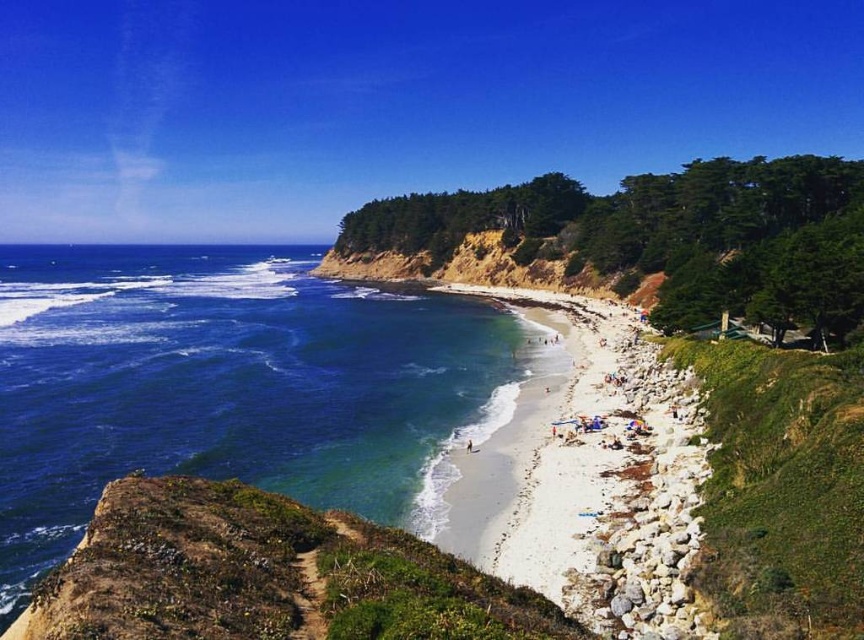
Is point (132, 298) more distant than point (612, 593)?

Yes, it is.

Based on the photo, is blue water at lower left bigger than white sand beach at center?

Correct, blue water at lower left is larger in size than white sand beach at center.

Who is more forward, [8,554] or [690,547]?

Positioned in front is point [690,547].

Where is `blue water at lower left`? The width and height of the screenshot is (864, 640). blue water at lower left is located at coordinates (234, 387).

Between point (46, 579) and point (653, 547), which one is positioned in front?

Point (46, 579) is more forward.

Who is taller, green mossy cliff at lower left or white sand beach at center?

white sand beach at center

The image size is (864, 640). What are the coordinates of `green mossy cliff at lower left` in the screenshot? It's located at (265, 576).

Locate an element on the screen. green mossy cliff at lower left is located at coordinates (265, 576).

Is blue water at lower left to the left of green mossy cliff at lower left from the viewer's perspective?

Correct, you'll find blue water at lower left to the left of green mossy cliff at lower left.

Is blue water at lower left thinner than green mossy cliff at lower left?

No, blue water at lower left is not thinner than green mossy cliff at lower left.

I want to click on blue water at lower left, so click(234, 387).

Where is `blue water at lower left`? The height and width of the screenshot is (640, 864). blue water at lower left is located at coordinates (234, 387).